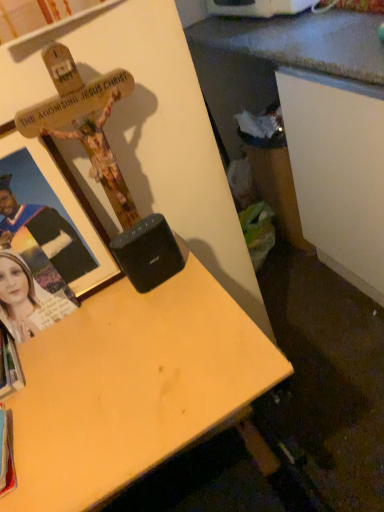
You are a GUI agent. You are given a task and a screenshot of the screen. Output one action in this format:
    pyautogui.click(x=<x>, y=<y>)
    Task: Click on the vacant area on top of light wood desk at center (from a real-world perspective)
    Image resolution: width=384 pixels, height=512 pixels.
    Given the screenshot: What is the action you would take?
    pyautogui.click(x=95, y=362)